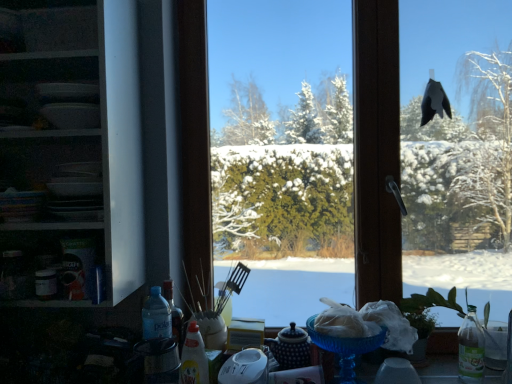
The width and height of the screenshot is (512, 384). What do you see at coordinates (194, 358) in the screenshot?
I see `translucent plastic bottle at center` at bounding box center [194, 358].

The width and height of the screenshot is (512, 384). Identify the location of transparent glass window at center. (329, 144).

Do you think transparent glass window at center is within white glossy shelves at left, or outside of it?

transparent glass window at center lies outside white glossy shelves at left.

How far apart are transparent glass window at center and white glossy shelves at left?

transparent glass window at center is 22.61 inches from white glossy shelves at left.

Which is behind, transparent glass window at center or white glossy shelves at left?

transparent glass window at center is behind.

Where is `shelf that appears above the transparent glass window at center (from a real-world perspective)`? The image size is (512, 384). shelf that appears above the transparent glass window at center (from a real-world perspective) is located at coordinates (75, 142).

From the image's perspective, is translucent plastic bottle at center located above or below transparent glass window at center?

translucent plastic bottle at center is situated lower than transparent glass window at center in the image.

Is translucent plastic bottle at center outside of transparent glass window at center?

translucent plastic bottle at center lies outside transparent glass window at center's area.

Consider the image. Is translucent plastic bottle at center turned away from transparent glass window at center?

Yes.

Could you tell me if translucent plastic bottle at center is turned towards blue glass bowl at lower center?

No, translucent plastic bottle at center is not facing towards blue glass bowl at lower center.

Who is shorter, translucent plastic bottle at center or blue glass bowl at lower center?

blue glass bowl at lower center is shorter.

Find the location of a particular element. tableware that is under the translucent plastic bottle at center (from a real-world perspective) is located at coordinates click(345, 350).

In terms of size, does translucent plastic bottle at center appear bigger or smaller than blue glass bowl at lower center?

Clearly, translucent plastic bottle at center is smaller in size than blue glass bowl at lower center.

Can you confirm if transparent glass window at center is thinner than blue glass bowl at lower center?

Yes.

Does point (391, 41) come behind point (373, 349)?

Yes, it is.

Can you confirm if transparent glass window at center is smaller than blue glass bowl at lower center?

Actually, transparent glass window at center might be larger than blue glass bowl at lower center.

This screenshot has width=512, height=384. I want to click on window located above the blue glass bowl at lower center (from the image's perspective), so click(329, 144).

Can you confirm if blue glass bowl at lower center is wider than white glossy shelves at left?

No.

Is blue glass bowl at lower center taller than white glossy shelves at left?

No.

Is point (364, 341) closer or farther from the camera than point (17, 205)?

Point (364, 341).

Are transparent glass window at center and translucent plastic bottle at center located far from each other?

No, there isn't a large distance between transparent glass window at center and translucent plastic bottle at center.

Can you tell me how much transparent glass window at center and translucent plastic bottle at center differ in facing direction?

The angle between the facing direction of transparent glass window at center and the facing direction of translucent plastic bottle at center is 21.4 degrees.

How far apart are transparent glass window at center and translucent plastic bottle at center?

They are 93.09 centimeters apart.

Considering the relative positions of transparent glass window at center and translucent plastic bottle at center in the image provided, is transparent glass window at center to the left or to the right of translucent plastic bottle at center?

transparent glass window at center is to the right of translucent plastic bottle at center.

Can you confirm if white glossy shelves at left is wider than transparent glass window at center?

Yes.

Do you think white glossy shelves at left is within transparent glass window at center, or outside of it?

white glossy shelves at left is not inside transparent glass window at center, it's outside.

Can you confirm if white glossy shelves at left is taller than transparent glass window at center?

In fact, white glossy shelves at left may be shorter than transparent glass window at center.

How many degrees apart are the facing directions of white glossy shelves at left and transparent glass window at center?

They differ by 0.835 degrees in their facing directions.

Locate an element on the screen. The width and height of the screenshot is (512, 384). window below the white glossy shelves at left (from the image's perspective) is located at coordinates (329, 144).

The width and height of the screenshot is (512, 384). What are the coordinates of `bottle in front of the transparent glass window at center` in the screenshot? It's located at (194, 358).

Estimate the real-world distances between objects in this image. Which object is closer to transparent glass window at center, translucent plastic bottle at center or blue glass bowl at lower center?

blue glass bowl at lower center is closer to transparent glass window at center.

Considering their positions, is transparent glass window at center positioned closer to blue glass bowl at lower center than white glossy shelves at left?

transparent glass window at center.

From the image, which object appears to be nearer to translucent plastic bottle at center, white glossy shelves at left or blue glass bowl at lower center?

The object closer to translucent plastic bottle at center is blue glass bowl at lower center.

From the image, which object appears to be farther from blue glass bowl at lower center, transparent glass window at center or translucent plastic bottle at center?

transparent glass window at center.

Based on their spatial positions, is white glossy shelves at left or translucent plastic bottle at center further from transparent glass window at center?

translucent plastic bottle at center is positioned further to the anchor transparent glass window at center.

Which object lies further to the anchor point transparent glass window at center, blue glass bowl at lower center or white glossy shelves at left?

blue glass bowl at lower center is further to transparent glass window at center.

From the image, which object appears to be farther from translucent plastic bottle at center, transparent glass window at center or white glossy shelves at left?

transparent glass window at center lies further to translucent plastic bottle at center than the other object.

Based on their spatial positions, is blue glass bowl at lower center or transparent glass window at center closer to white glossy shelves at left?

transparent glass window at center.

Image resolution: width=512 pixels, height=384 pixels. I want to click on bottle between transparent glass window at center and blue glass bowl at lower center in the vertical direction, so click(x=194, y=358).

You are a GUI agent. You are given a task and a screenshot of the screen. Output one action in this format:
    pyautogui.click(x=<x>, y=<y>)
    Task: Click on the bottle between white glossy shelves at left and transparent glass window at center from left to right
    The image size is (512, 384).
    Given the screenshot: What is the action you would take?
    pyautogui.click(x=194, y=358)

Where is `tableware located between white glossy shelves at left and transparent glass window at center in the left-right direction`? Image resolution: width=512 pixels, height=384 pixels. tableware located between white glossy shelves at left and transparent glass window at center in the left-right direction is located at coordinates (345, 350).

This screenshot has width=512, height=384. Identify the location of bottle between white glossy shelves at left and blue glass bowl at lower center from left to right. (194, 358).